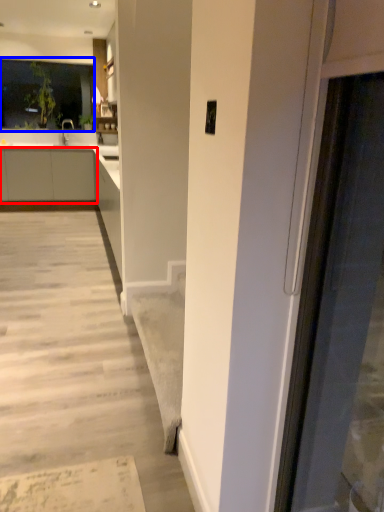
Question: Which point is further to the camera, cabinetry (highlighted by a red box) or window (highlighted by a blue box)?

Choices:
 (A) cabinetry
 (B) window

Answer: (B)